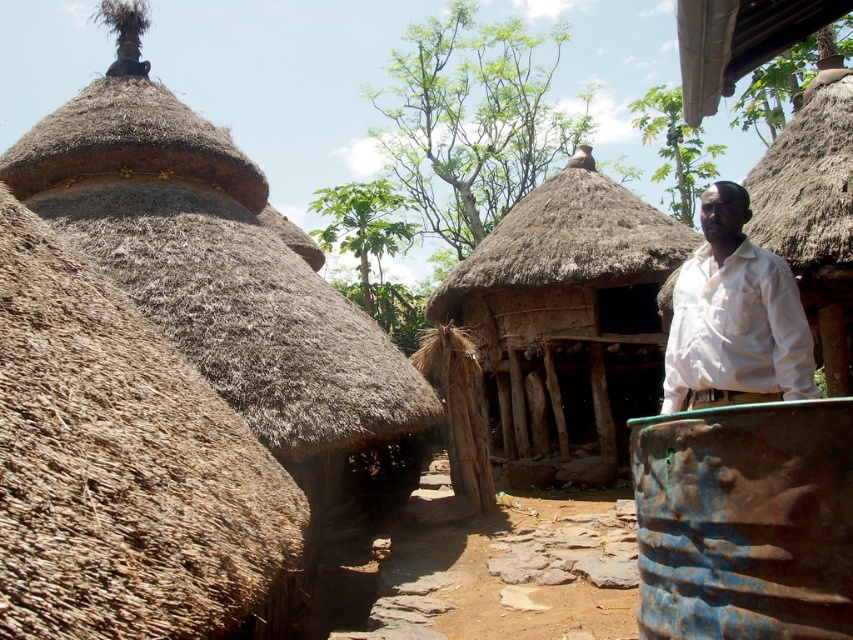
In order to click on rusty metal barrel at right in this screenshot , I will do [x=746, y=522].

Can you confirm if rusty metal barrel at right is smaller than brown thatch roof at center?

Yes, rusty metal barrel at right is smaller than brown thatch roof at center.

Between point (757, 460) and point (477, 273), which one is positioned in front?

Point (757, 460)

Where is `rusty metal barrel at right`? rusty metal barrel at right is located at coordinates coord(746,522).

Does point (746, 547) come closer to viewer compared to point (805, 358)?

Yes, point (746, 547) is in front of point (805, 358).

How far apart are rusty metal barrel at right and white cotton shirt at right?

rusty metal barrel at right and white cotton shirt at right are 1.05 meters apart from each other.

This screenshot has height=640, width=853. I want to click on rusty metal barrel at right, so click(746, 522).

Is point (697, 380) closer to camera compared to point (567, 216)?

Yes, point (697, 380) is in front of point (567, 216).

Who is positioned more to the right, white cotton shirt at right or brown thatch roof at center?

brown thatch roof at center

I want to click on white cotton shirt at right, so click(734, 317).

This screenshot has height=640, width=853. Find the location of `white cotton shirt at right`. white cotton shirt at right is located at coordinates (734, 317).